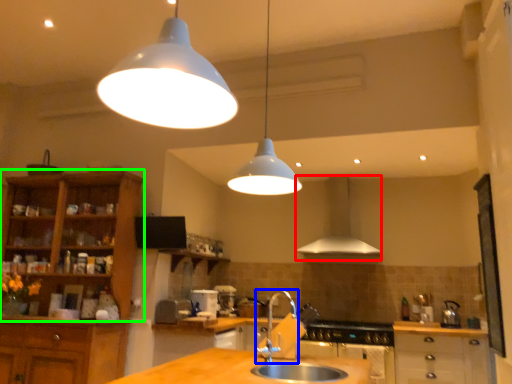
Question: Estimate the real-world distances between objects in this image. Which object is farther from exhaust hood (highlighted by a red box), tap (highlighted by a blue box) or cabinetry (highlighted by a green box)?

Choices:
 (A) tap
 (B) cabinetry

Answer: (B)